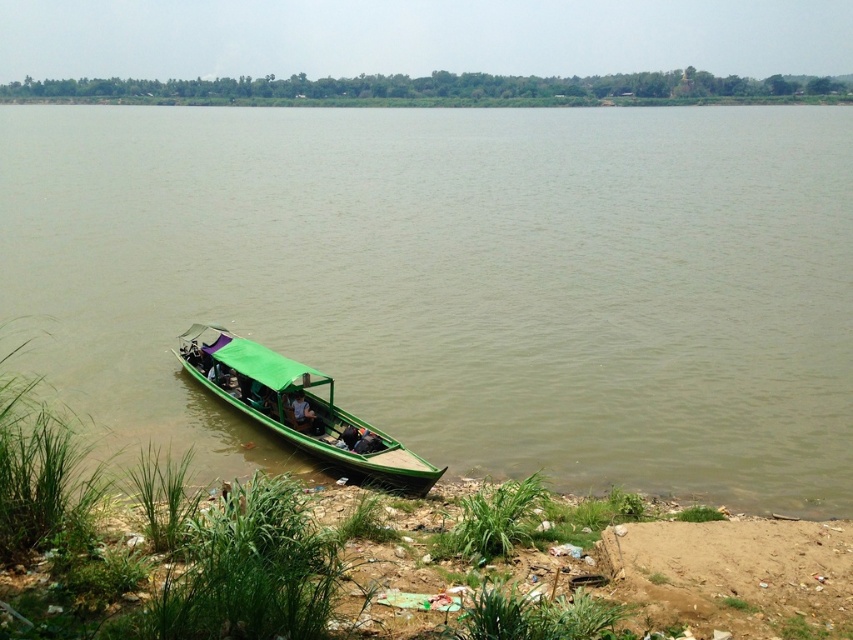
You are a photographer standing on the riverbank. You want to take a photo that includes both the green wooden boat at lower left and the green fabric person at center. Since the boat is larger, will it appear closer to you in the photo than the person?

The green wooden boat at lower left is larger in size compared to the green fabric person at center. In photography, larger objects in a photo can give the illusion of being closer to the viewer, so yes, the boat will appear closer in the photo than the person.

You are a photographer planning to take a photo of the green wooden boat at lower left and the green matte boat at lower center. Since you want both boats to be clearly visible in the frame, which boat should you position closer to the camera to ensure the smaller one isn not overwhelmed by the larger one?

The green matte boat at lower center is smaller than the green wooden boat at lower left. To ensure it isn not overwhelmed, position the green matte boat at lower center closer to the camera so its size in the photo matches the green wooden boat at lower left.

You are standing at point (457, 282) in the riverside scene. What object is located exactly at your current position?

The green wooden boat at lower left is located exactly at point (457, 282).